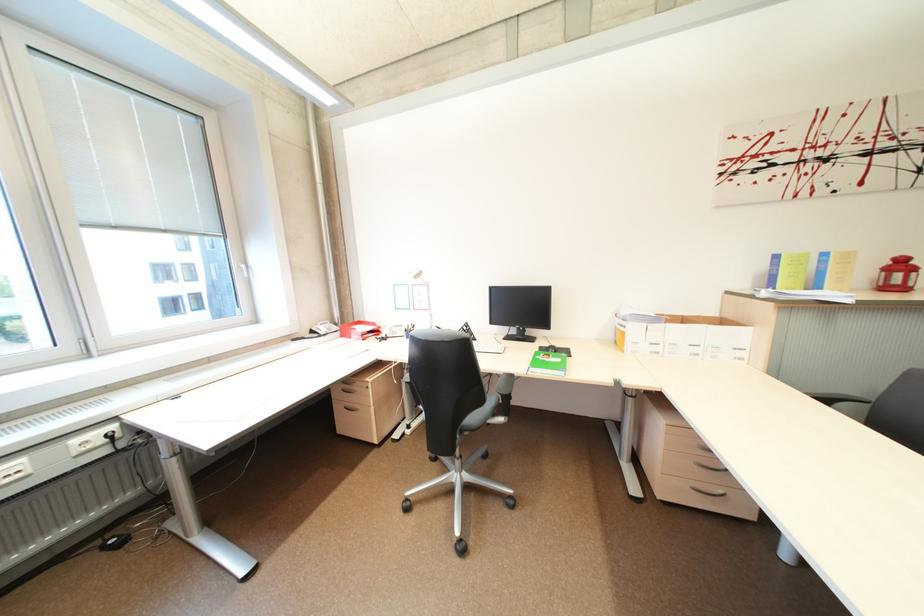
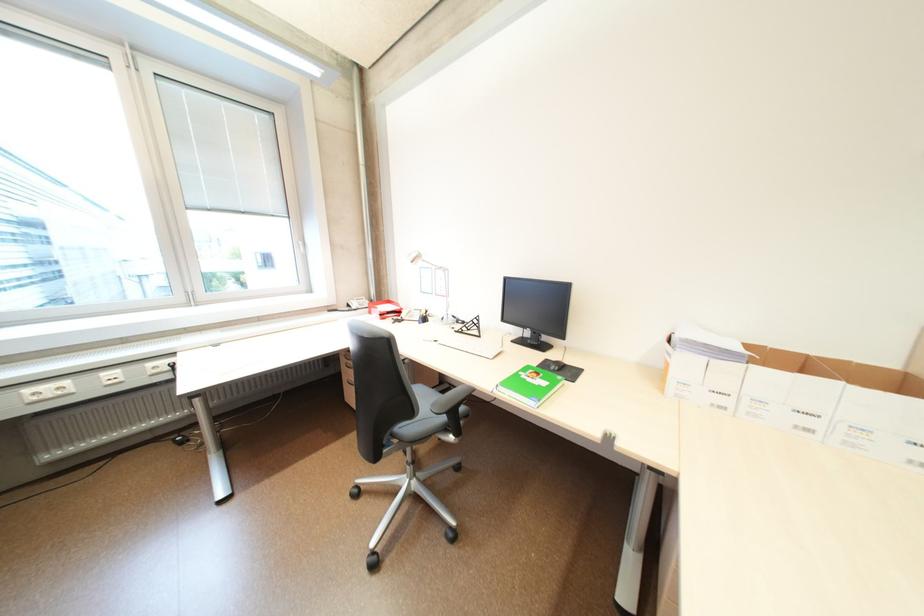
From the picture: The images are taken continuously from a first-person perspective. In which direction are you moving?

The cameraman moved toward right, forward.